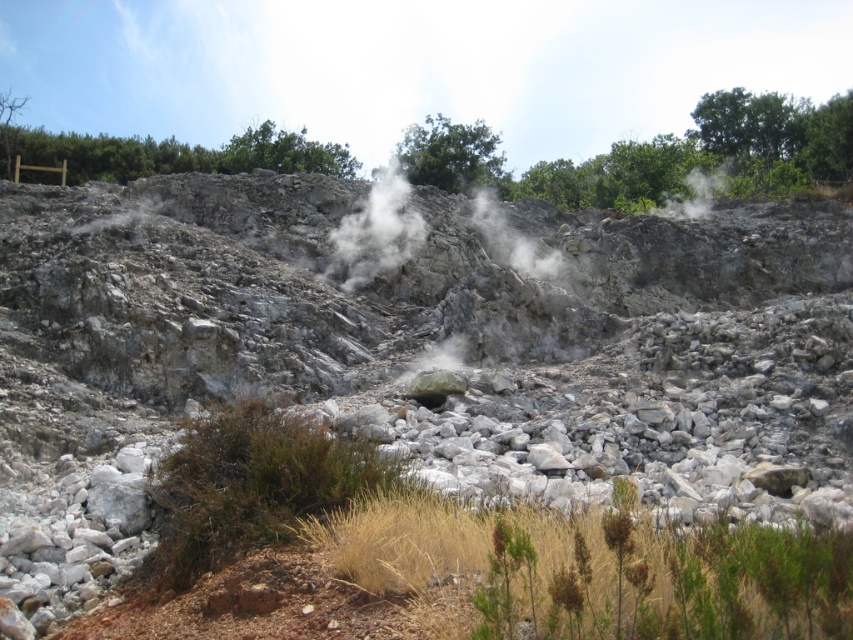
Does white vapor at center appear on the right side of white smoke at upper center?

In fact, white vapor at center is to the left of white smoke at upper center.

This screenshot has height=640, width=853. Identify the location of white vapor at center. (376, 232).